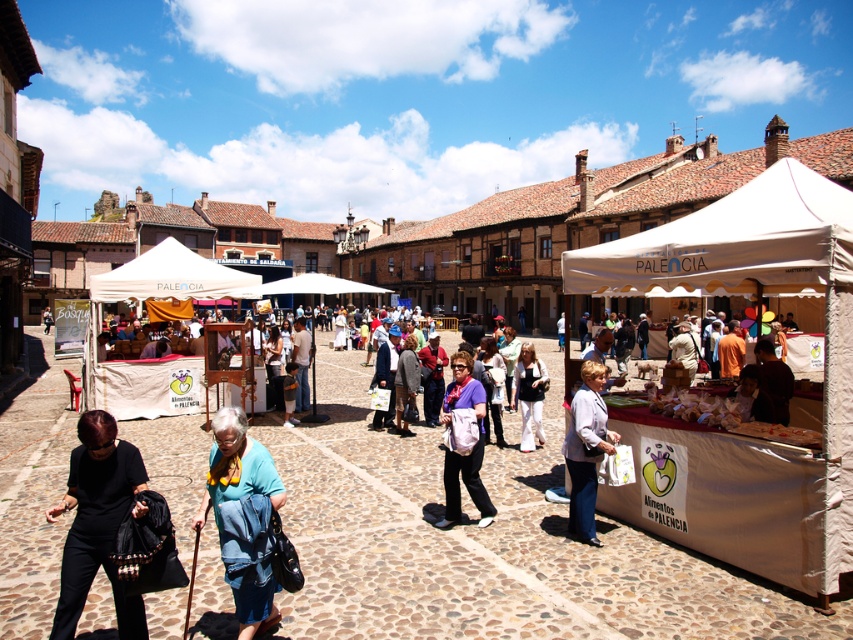
Question: Does blue fabric at center have a larger size compared to white cotton pants at center?

Choices:
 (A) no
 (B) yes

Answer: (B)

Question: Among these points, which one is farthest from the camera?

Choices:
 (A) (474, 416)
 (B) (141, 596)

Answer: (A)

Question: Which of the following is the farthest from the observer?

Choices:
 (A) (469, 480)
 (B) (144, 273)
 (C) (561, 282)
 (D) (523, 356)

Answer: (C)

Question: Is black matte pants at lower left smaller than blue fabric at center?

Choices:
 (A) no
 (B) yes

Answer: (B)

Question: Can you confirm if blue fabric at center is positioned to the left of light blue fabric jacket at lower right?

Choices:
 (A) yes
 (B) no

Answer: (A)

Question: Which of these objects is positioned closest to the white fabric canopy at center?

Choices:
 (A) matte white bag at center
 (B) white cotton pants at center

Answer: (A)